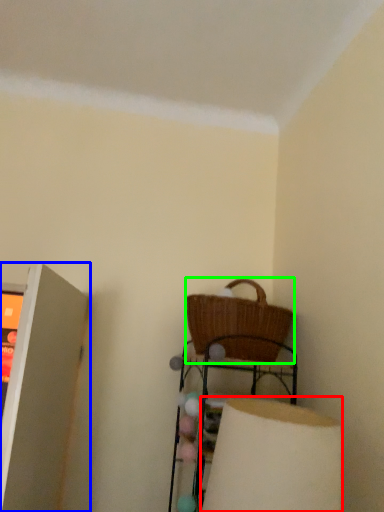
Question: Which object is positioned farthest from lamp (highlighted by a red box)? Select from shelf (highlighted by a blue box) and picnic basket (highlighted by a green box).

Choices:
 (A) shelf
 (B) picnic basket

Answer: (A)